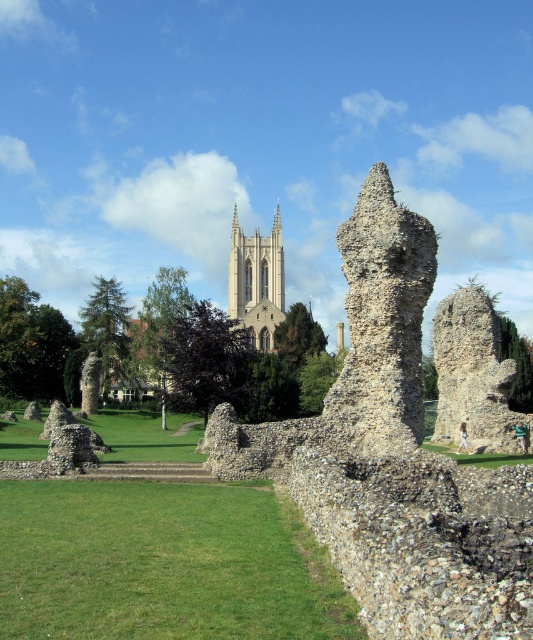
Question: Is rustic stone tower at center positioned behind white stone tower at center?

Choices:
 (A) no
 (B) yes

Answer: (A)

Question: Which point is closer to the camera taking this photo?

Choices:
 (A) (397, 372)
 (B) (478, 374)
 (C) (402, 216)

Answer: (A)

Question: Based on their relative distances, which object is nearer to the rustic stone sculpture at center?

Choices:
 (A) rustic stone ruins at center
 (B) white stone tower at center

Answer: (A)

Question: Does rustic stone ruins at center lie in front of rustic stone tower at center?

Choices:
 (A) no
 (B) yes

Answer: (B)

Question: Which point appears closest to the camera in this image?

Choices:
 (A) (497, 444)
 (B) (351, 593)
 (C) (365, 262)

Answer: (B)

Question: Can you confirm if rustic stone ruins at center is positioned to the right of rustic stone sculpture at center?

Choices:
 (A) no
 (B) yes

Answer: (B)